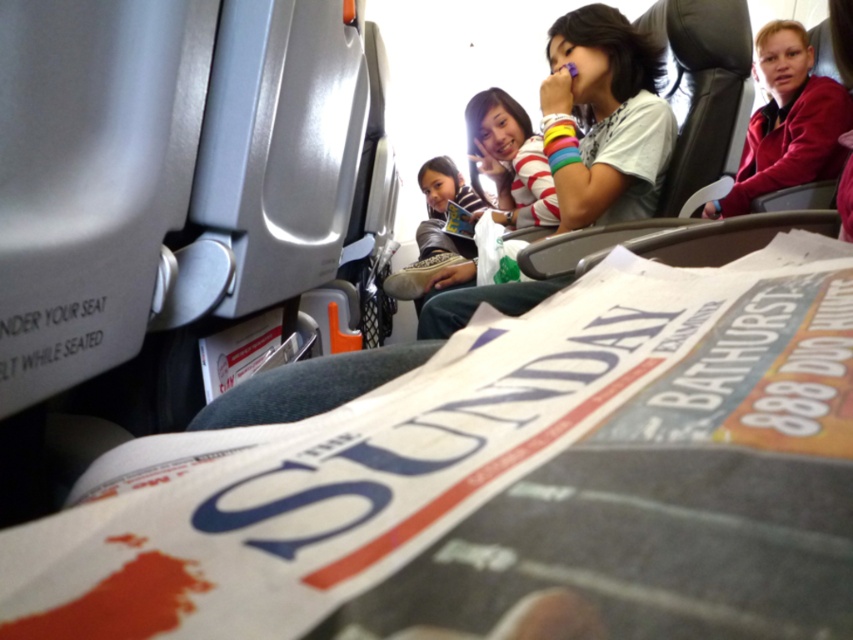
Question: Which object is closer to the camera taking this photo?

Choices:
 (A) white striped shirt at upper center
 (B) white glossy newspaper at center
 (C) maroon fabric jacket at upper right

Answer: (B)

Question: Among these objects, which one is farthest from the camera?

Choices:
 (A) maroon fabric jacket at upper right
 (B) white striped shirt at upper center

Answer: (A)

Question: Is white glossy newspaper at center to the right of maroon fabric jacket at upper right from the viewer's perspective?

Choices:
 (A) no
 (B) yes

Answer: (A)

Question: Estimate the real-world distances between objects in this image. Which object is closer to the white glossy newspaper at center?

Choices:
 (A) white striped shirt at upper center
 (B) maroon fabric jacket at upper right

Answer: (A)

Question: Can you confirm if white glossy newspaper at center is smaller than maroon fabric jacket at upper right?

Choices:
 (A) yes
 (B) no

Answer: (A)

Question: Is white striped shirt at upper center bigger than maroon fabric jacket at upper right?

Choices:
 (A) yes
 (B) no

Answer: (B)